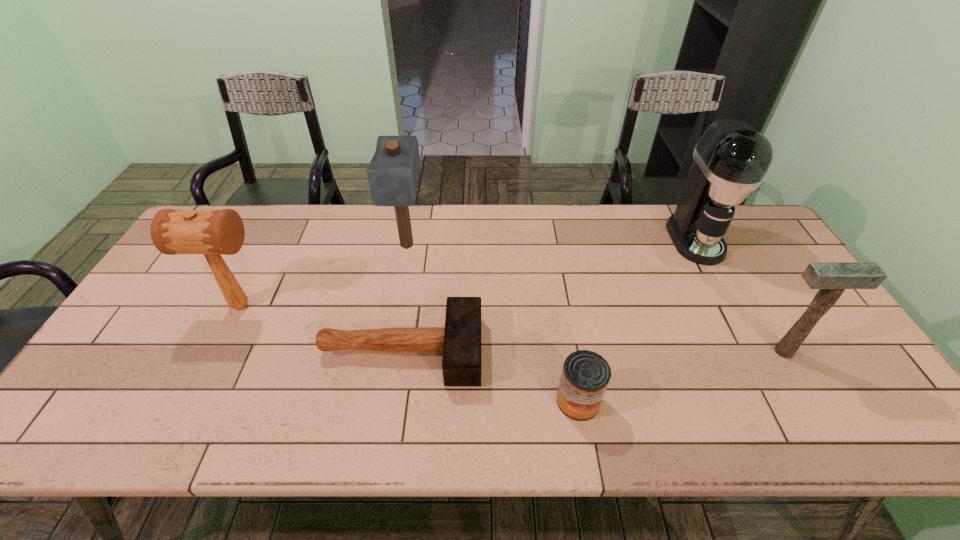
Image resolution: width=960 pixels, height=540 pixels. In the image, there is a desktop. What are the coordinates of `vacant space at the near edge` in the screenshot? It's located at (217, 424).

In the image, there is a desktop. Where is `vacant space at the left edge`? The width and height of the screenshot is (960, 540). vacant space at the left edge is located at coordinates (136, 316).

The width and height of the screenshot is (960, 540). Identify the location of vacant space at the near left corner. (100, 407).

Image resolution: width=960 pixels, height=540 pixels. In the image, there is a desktop. What are the coordinates of `vacant space at the far right corner` in the screenshot? It's located at (739, 225).

You are a GUI agent. You are given a task and a screenshot of the screen. Output one action in this format:
    pyautogui.click(x=<x>, y=<y>)
    Task: Click on the vacant space at the near right corner of the desktop
    
    Given the screenshot: What is the action you would take?
    pyautogui.click(x=858, y=409)

You are a GUI agent. You are given a task and a screenshot of the screen. Output one action in this format:
    pyautogui.click(x=<x>, y=<y>)
    Task: Click on the free space between the rightmost mallet and the leftmost mallet
    The width and height of the screenshot is (960, 540).
    Given the screenshot: What is the action you would take?
    pyautogui.click(x=512, y=328)

Find the location of a particular element. The image size is (960, 540). empty space that is in between the second shortest object and the farthest mallet is located at coordinates (492, 323).

The width and height of the screenshot is (960, 540). In order to click on free space between the leftmost object and the shortest object in this screenshot , I will do `click(321, 328)`.

Identify the location of free space between the farthest mallet and the rightmost mallet. Image resolution: width=960 pixels, height=540 pixels. (595, 299).

Find the location of `vacant area that lies between the leftmost mallet and the shortest mallet`. vacant area that lies between the leftmost mallet and the shortest mallet is located at coordinates (321, 328).